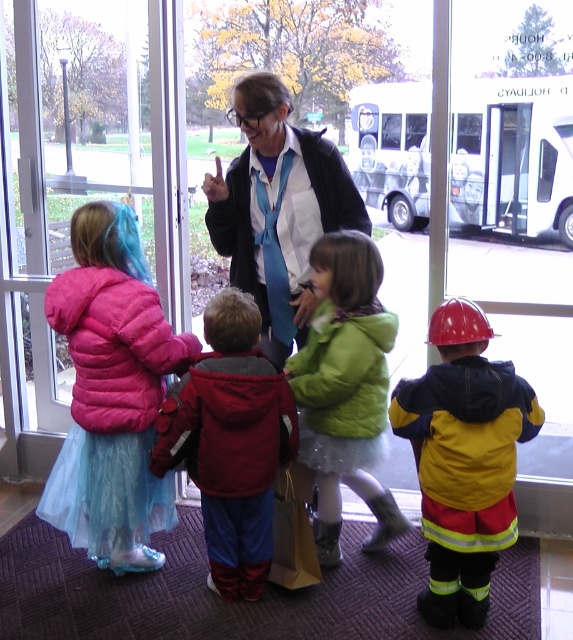
Which is more to the left, puffy pink fabric dress at left or matte blue tie at center?

Positioned to the left is puffy pink fabric dress at left.

Is puffy pink fabric dress at left smaller than matte blue tie at center?

Correct, puffy pink fabric dress at left occupies less space than matte blue tie at center.

Which is in front, point (83, 444) or point (354, 220)?

Point (83, 444) is in front.

At what (x,y) coordinates should I click in order to perform the action: click on puffy pink fabric dress at left. Please return your answer as a coordinate pair (x, y). The image size is (573, 640). Looking at the image, I should click on (111, 410).

Is red fleece jacket at center above matte blue tie at center?

No, red fleece jacket at center is not above matte blue tie at center.

Which is more to the right, red fleece jacket at center or matte blue tie at center?

matte blue tie at center

Between point (249, 358) and point (260, 218), which one is positioned in front?

Point (249, 358)

Where is `red fleece jacket at center`? This screenshot has width=573, height=640. red fleece jacket at center is located at coordinates (230, 442).

Which is below, puffy pink fabric dress at left or yellow matte jacket at center?

yellow matte jacket at center

Who is positioned more to the right, puffy pink fabric dress at left or yellow matte jacket at center?

From the viewer's perspective, yellow matte jacket at center appears more on the right side.

Image resolution: width=573 pixels, height=640 pixels. In order to click on puffy pink fabric dress at left in this screenshot , I will do `click(111, 410)`.